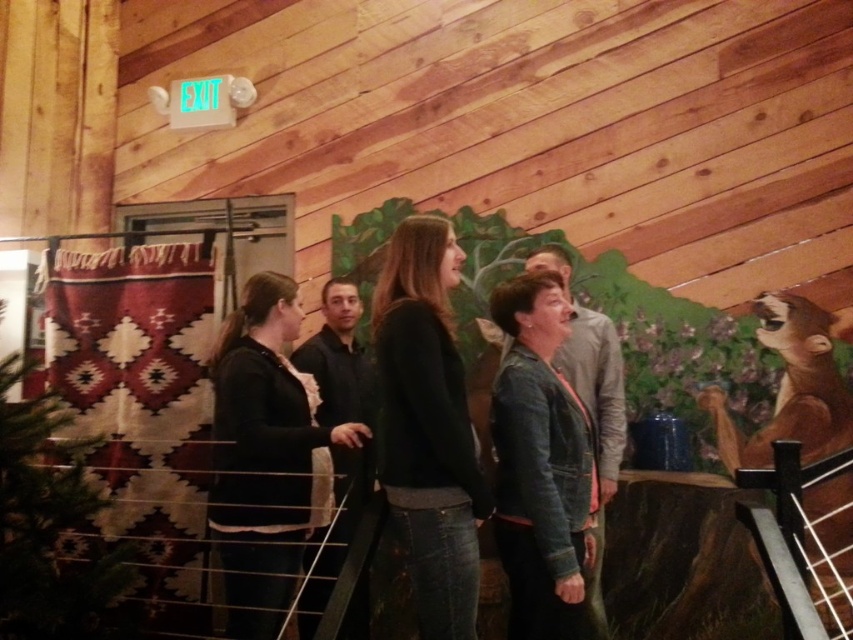
Question: Among these points, which one is farthest from the camera?

Choices:
 (A) (77, 410)
 (B) (788, 400)

Answer: (A)

Question: Can you confirm if red and white woven quilt at left is positioned to the right of brown furry bear at right?

Choices:
 (A) yes
 (B) no

Answer: (B)

Question: Which of the following is the closest to the observer?

Choices:
 (A) (280, 524)
 (B) (820, 509)

Answer: (A)

Question: Which object is farther from the camera taking this photo?

Choices:
 (A) red and white woven quilt at left
 (B) black matte sweater at center
 (C) black matte jacket at center
 (D) denim jacket at center

Answer: (A)

Question: Does black matte sweater at center have a smaller size compared to brown furry bear at right?

Choices:
 (A) yes
 (B) no

Answer: (A)

Question: Does red and white woven quilt at left have a larger size compared to brown furry bear at right?

Choices:
 (A) no
 (B) yes

Answer: (A)